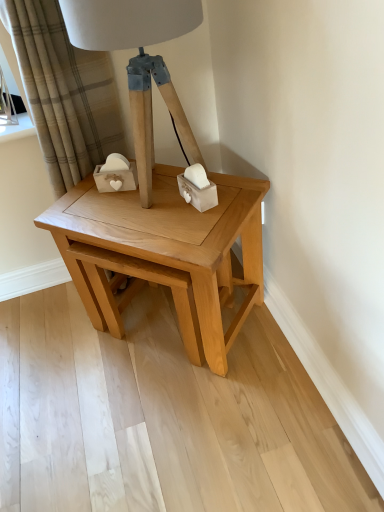
Where is `vacant space in front of beige plaid curtain at upper left`? This screenshot has width=384, height=512. vacant space in front of beige plaid curtain at upper left is located at coordinates (81, 344).